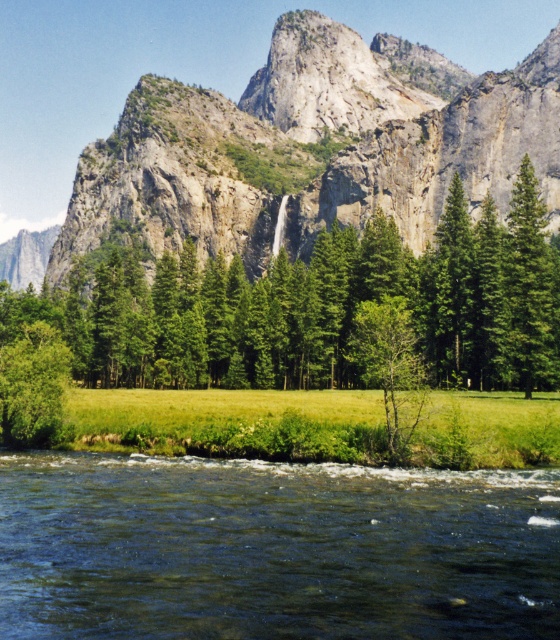
You are standing at the edge of the river and want to locate the dark green water at lower center. According to the coordinates provided, where would you look relative to your current position?

The dark green water at lower center is located at point 0.859 on the x axis and 0.487 on the y axis relative to your current position.

From the picture: You are standing at the edge of the dark green water at lower center and want to reach the green leafy tree at center. Which direction should you move to get closer to the tree?

The dark green water at lower center is positioned under the green leafy tree at center, so to reach the tree, you should move upward from the water towards the tree.

You are a hiker standing at the edge of the dark green water at lower center. You want to reach the green leafy tree at center. Which direction should you move to get closer to the tree?

The dark green water at lower center is smaller in size compared to the green leafy tree at center, so to reach the tree, you should move forward from the water towards the center of the scene where the tree is located.